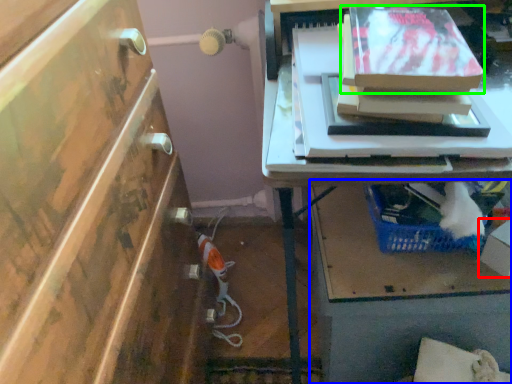
Question: Which object is positioned farthest from box (highlighted by a red box)? Select from vanity (highlighted by a blue box) and storage box (highlighted by a green box).

Choices:
 (A) vanity
 (B) storage box

Answer: (B)